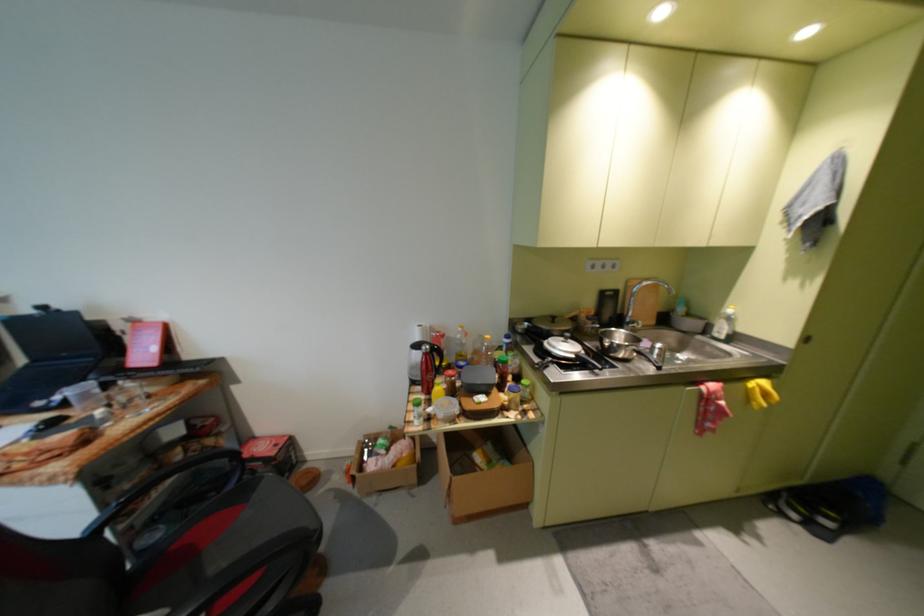
The width and height of the screenshot is (924, 616). Find the location of `white plastic container`. white plastic container is located at coordinates [x=445, y=408].